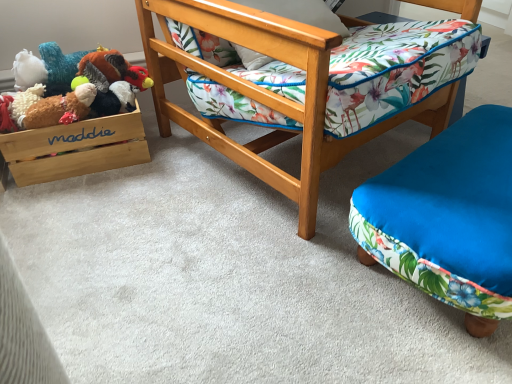
The height and width of the screenshot is (384, 512). What are the coordinates of `free space to the left of wooden chair at center` in the screenshot? It's located at (122, 203).